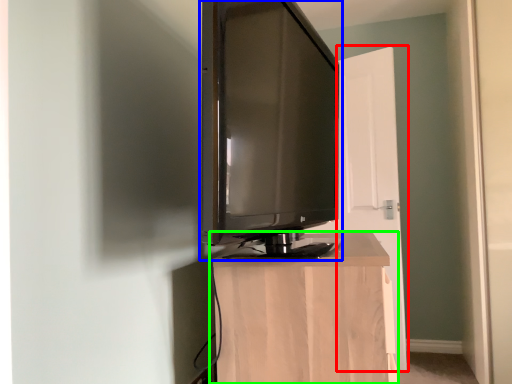
Question: Which is farther away from door (highlighted by a red box)? television (highlighted by a blue box) or furniture (highlighted by a green box)?

Choices:
 (A) television
 (B) furniture

Answer: (B)